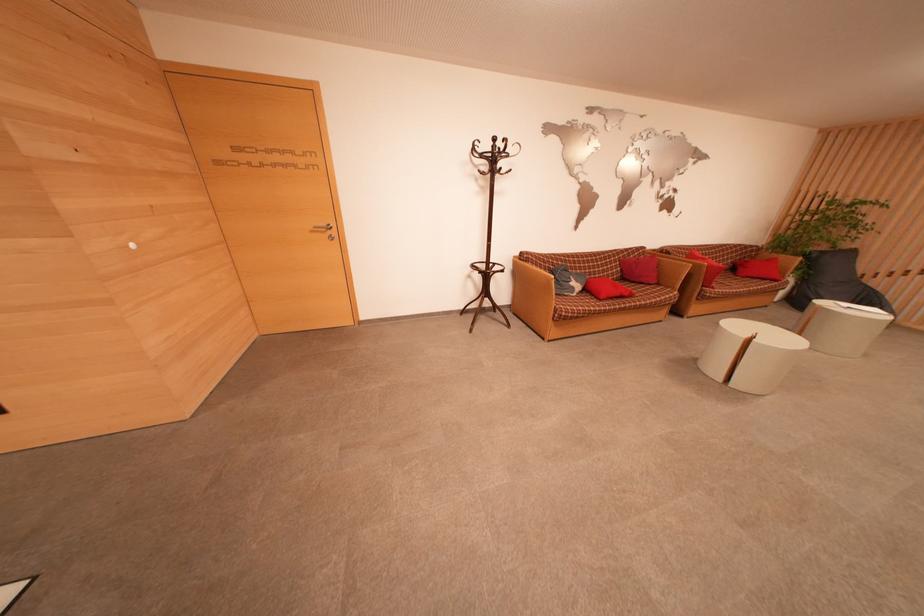
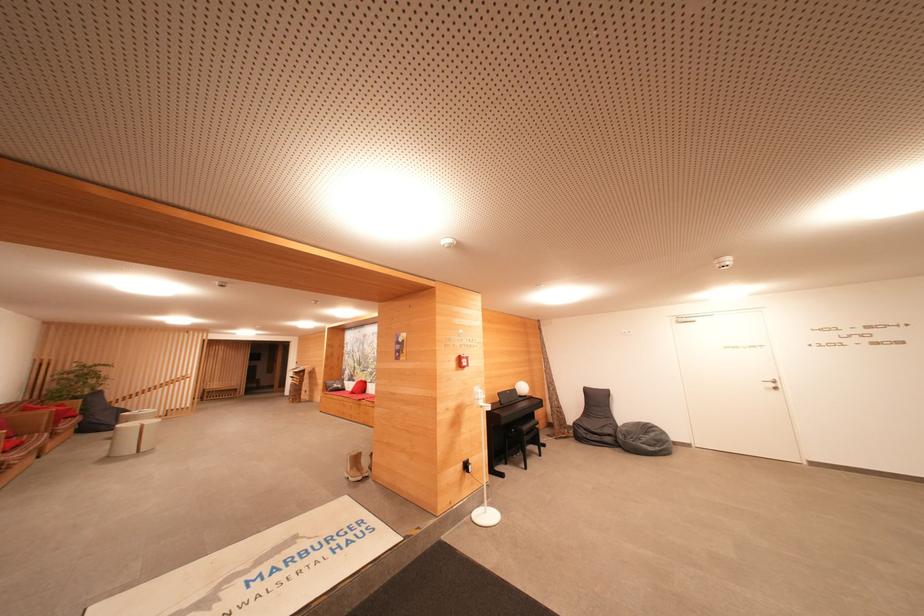
Where in the second image is the point corresponding to point (856, 256) from the first image?

(103, 395)